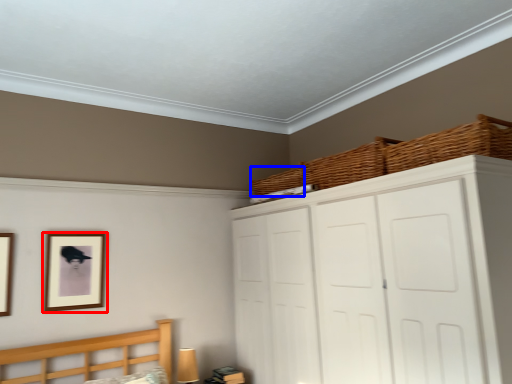
Question: Among these objects, which one is nearest to the camera, picture frame (highlighted by a red box) or basket (highlighted by a blue box)?

Choices:
 (A) picture frame
 (B) basket

Answer: (A)